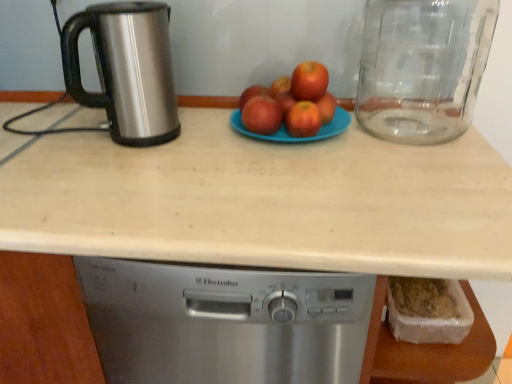
Question: Considering the relative sizes of beige laminate countertop at center and red matte apples at center, marked as the 2th apple in a left-to-right arrangement, in the image provided, is beige laminate countertop at center smaller than red matte apples at center, marked as the 2th apple in a left-to-right arrangement,?

Choices:
 (A) no
 (B) yes

Answer: (A)

Question: Would you say beige laminate countertop at center is outside red matte apples at center, marked as the 2th apple in a left-to-right arrangement?

Choices:
 (A) no
 (B) yes

Answer: (B)

Question: Does beige laminate countertop at center appear on the right side of red matte apples at center, marked as the 2th apple in a left-to-right arrangement?

Choices:
 (A) no
 (B) yes

Answer: (A)

Question: From a real-world perspective, is beige laminate countertop at center located beneath red matte apples at center, the fifth apple viewed from the right?

Choices:
 (A) yes
 (B) no

Answer: (A)

Question: Is the depth of beige laminate countertop at center greater than that of red matte apples at center, marked as the 2th apple in a left-to-right arrangement?

Choices:
 (A) yes
 (B) no

Answer: (B)

Question: Does beige laminate countertop at center have a lesser width compared to red matte apples at center, the fifth apple viewed from the right?

Choices:
 (A) yes
 (B) no

Answer: (B)

Question: Can you confirm if red matte apple at center, which ranks as the 4th apple in right-to-left order, is bigger than red matte apple at center, which is the third apple from right to left?

Choices:
 (A) yes
 (B) no

Answer: (B)

Question: Is red matte apple at center, the third apple in the left-to-right sequence, to the right of red matte apple at center, which is the third apple from right to left, from the viewer's perspective?

Choices:
 (A) no
 (B) yes

Answer: (A)

Question: Is red matte apple at center, the third apple in the left-to-right sequence, beside red matte apple at center, which is the third apple from right to left?

Choices:
 (A) yes
 (B) no

Answer: (A)

Question: Is red matte apple at center, the third apple in the left-to-right sequence, far away from red matte apple at center, which is the third apple from right to left?

Choices:
 (A) yes
 (B) no

Answer: (B)

Question: Can you confirm if red matte apple at center, which ranks as the 4th apple in right-to-left order, is smaller than red matte apple at center, which is the third apple from right to left?

Choices:
 (A) no
 (B) yes

Answer: (B)

Question: Can you confirm if red matte apple at center, which ranks as the 4th apple in right-to-left order, is taller than red matte apple at center, the fourth apple when ordered from left to right?

Choices:
 (A) yes
 (B) no

Answer: (B)

Question: From a real-world perspective, is stainless steel kettle at left located higher than beige laminate countertop at center?

Choices:
 (A) yes
 (B) no

Answer: (A)